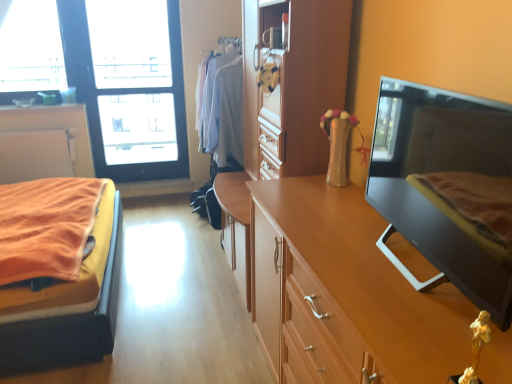
Question: Does point (143, 72) appear closer or farther from the camera than point (266, 84)?

Choices:
 (A) closer
 (B) farther

Answer: (B)

Question: Looking at their shapes, would you say transparent glass window at upper left is wider or thinner than wooden dresser at center?

Choices:
 (A) thin
 (B) wide

Answer: (A)

Question: Which object is positioned closest to the black glossy tv at right?

Choices:
 (A) white matte radiator at left, which is the second cabinetry from bottom to top
 (B) transparent glass window at upper left
 (C) orange fabric bed at left
 (D) wooden cabinet at right, which is the 2th cabinetry in back-to-front order
 (E) wooden dresser at center

Answer: (D)

Question: Which of these objects is positioned farthest from the white matte radiator at left, acting as the 2th cabinetry starting from the right?

Choices:
 (A) orange fabric bed at left
 (B) wooden dresser at center
 (C) wooden cabinet at right, arranged as the second cabinetry when viewed from the left
 (D) black glossy tv at right
 (E) transparent glass window at upper left

Answer: (D)